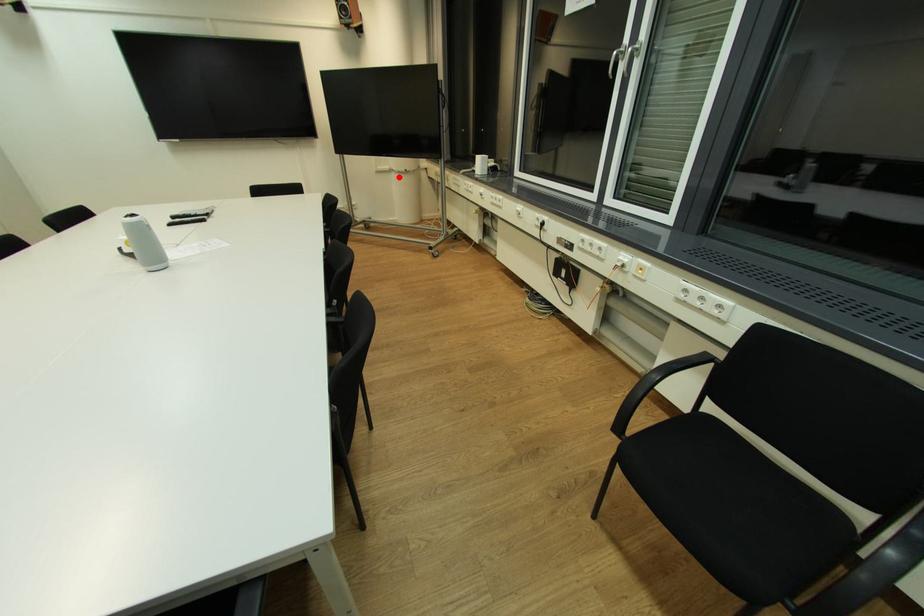
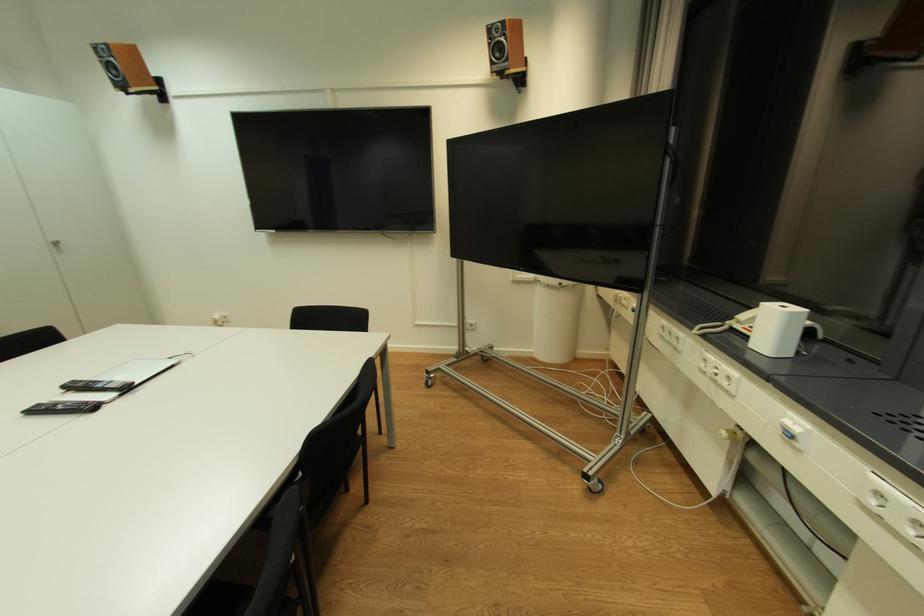
Question: A red point is marked in image1. In image2, is the corresponding 3D point closer to the camera or farther? Reply with the corresponding letter.

Choices:
 (A) The corresponding 3D point is closer.
 (B) The corresponding 3D point is farther.

Answer: (B)